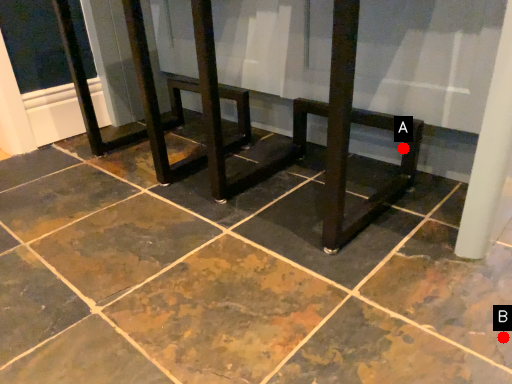
Question: Two points are circled on the image, labeled by A and B beside each circle. Which point is farther to the camera?

Choices:
 (A) A is further
 (B) B is further

Answer: (A)